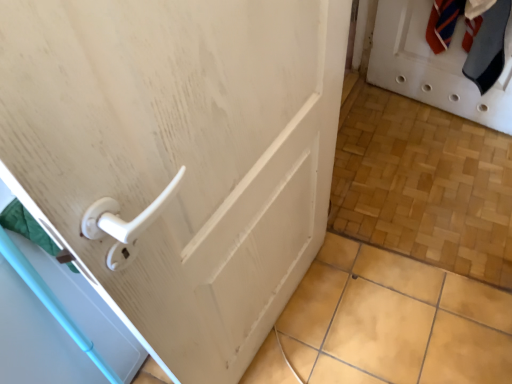
Question: Can you confirm if white matte door at upper right is smaller than white plastic handle at left?

Choices:
 (A) yes
 (B) no

Answer: (A)

Question: Is white matte door at upper right in contact with white plastic handle at left?

Choices:
 (A) yes
 (B) no

Answer: (B)

Question: From a real-world perspective, is white matte door at upper right positioned under white plastic handle at left based on gravity?

Choices:
 (A) yes
 (B) no

Answer: (B)

Question: From a real-world perspective, is white matte door at upper right physically above white plastic handle at left?

Choices:
 (A) yes
 (B) no

Answer: (A)

Question: Can you confirm if white matte door at upper right is bigger than white plastic handle at left?

Choices:
 (A) no
 (B) yes

Answer: (A)

Question: From the image's perspective, does white matte door at upper right appear higher than white plastic handle at left?

Choices:
 (A) no
 (B) yes

Answer: (B)

Question: Does white plastic handle at left have a smaller size compared to white matte door at upper right?

Choices:
 (A) yes
 (B) no

Answer: (B)

Question: From the image's perspective, would you say white plastic handle at left is positioned over white matte door at upper right?

Choices:
 (A) no
 (B) yes

Answer: (A)

Question: Is white plastic handle at left oriented towards white matte door at upper right?

Choices:
 (A) yes
 (B) no

Answer: (B)

Question: Does white plastic handle at left have a greater width compared to white matte door at upper right?

Choices:
 (A) no
 (B) yes

Answer: (B)

Question: Is the surface of white plastic handle at left in direct contact with white matte door at upper right?

Choices:
 (A) no
 (B) yes

Answer: (A)

Question: From a real-world perspective, is white plastic handle at left on top of white matte door at upper right?

Choices:
 (A) yes
 (B) no

Answer: (B)

Question: From a real-world perspective, is white matte door at upper right positioned above or below white plastic handle at left?

Choices:
 (A) below
 (B) above

Answer: (B)